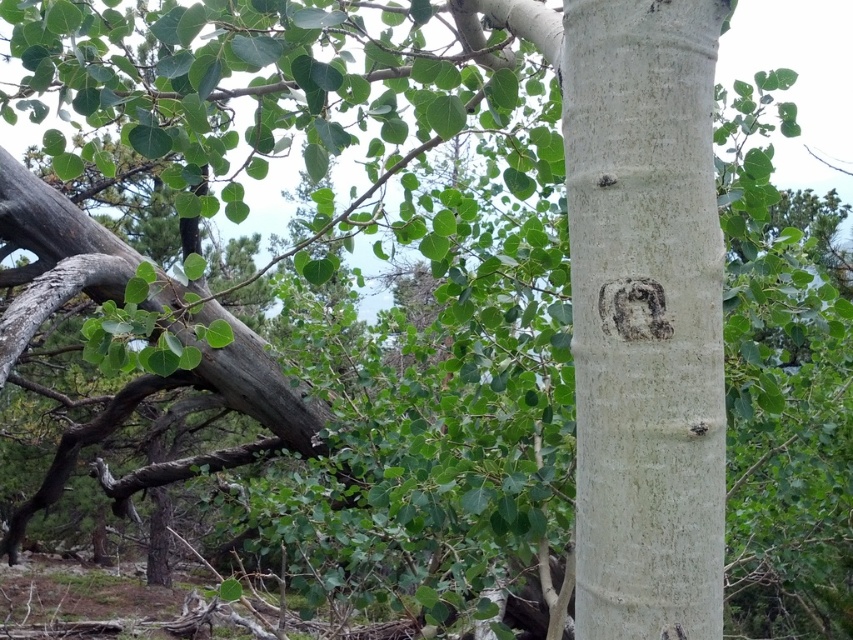
You are a botanist measuring tree trunks. You see the white smooth tree trunk at center and the smooth gray stone face at center. Which one do you think is wider?

The white smooth tree trunk at center might be wider than smooth gray stone face at center.

You are standing in a forest and see the white smooth tree trunk at center and the smooth gray stone face at center. Which object is taller?

The white smooth tree trunk at center is taller than the smooth gray stone face at center.

Consider the image. You are a photographer standing at a certain distance from the white smooth tree trunk at center. Your camera requires you to be within 30 inches to capture the trunk in full detail. Can you capture the trunk clearly without moving closer?

The distance between you and the white smooth tree trunk at center is 32.12 inches, which is beyond the 30 inches required for clear capture. Therefore, you need to move closer to within 30 inches to capture the trunk in full detail.